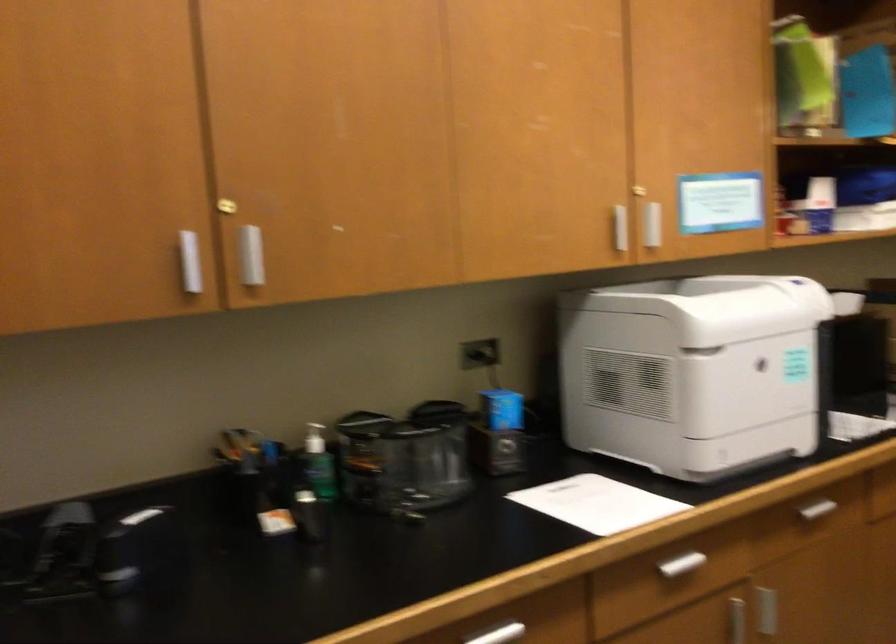
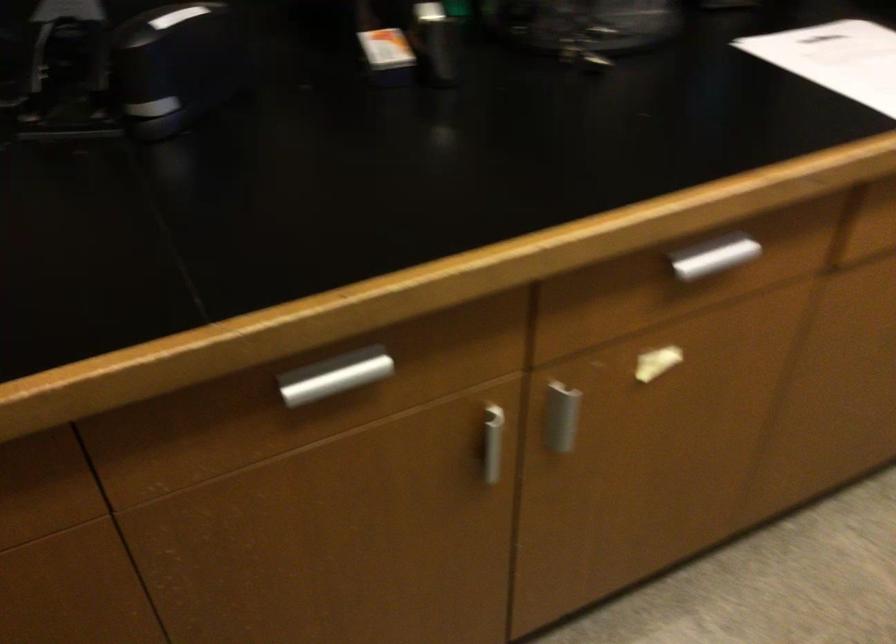
The point at (567, 502) is marked in the first image. Where is the corresponding point in the second image?

(836, 59)